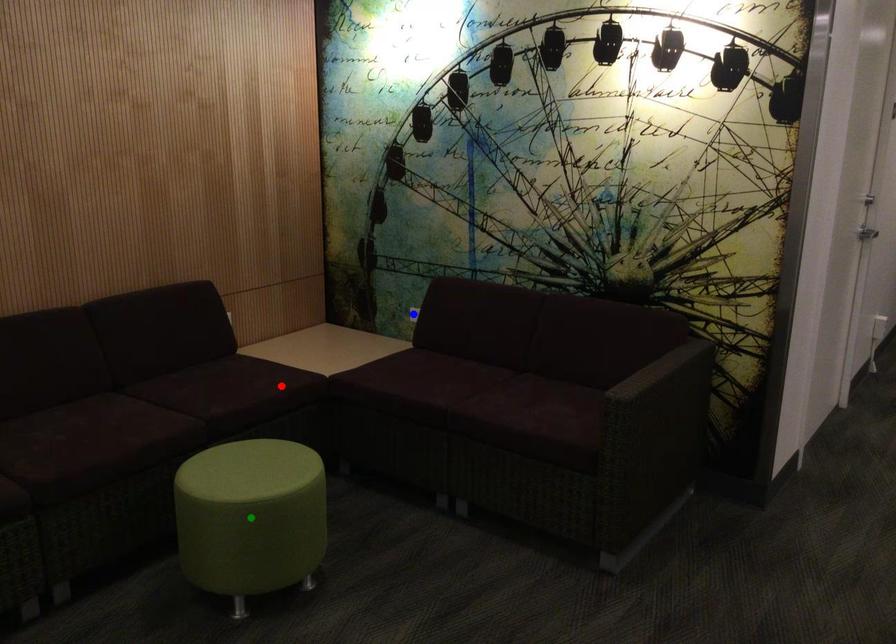
Order these from nearest to farthest:
blue point, green point, red point

green point
red point
blue point